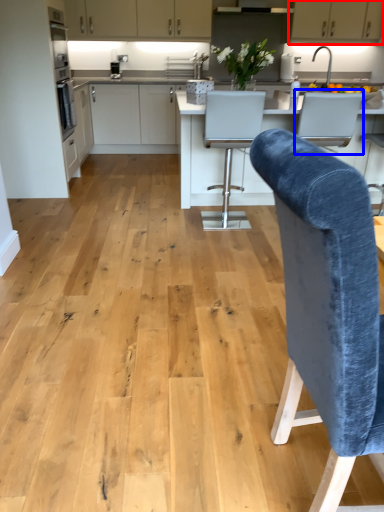
Question: Which of the following is the closest to the observer, cabinetry (highlighted by a red box) or armchair (highlighted by a blue box)?

Choices:
 (A) cabinetry
 (B) armchair

Answer: (B)